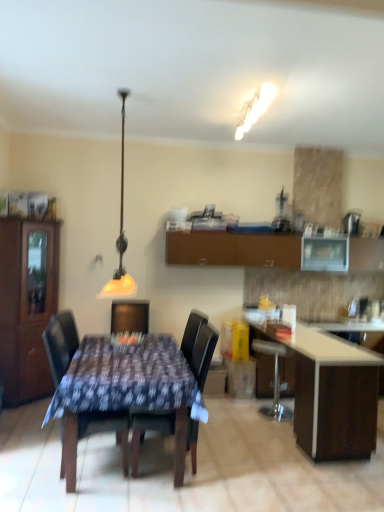
This screenshot has height=512, width=384. Describe the element at coordinates (60, 343) in the screenshot. I see `black wood chair at center, marked as the 1th chair in a left-to-right arrangement` at that location.

What do you see at coordinates (25, 310) in the screenshot? The width and height of the screenshot is (384, 512). I see `brown wood cabinet at left, the second cabinetry viewed from the back` at bounding box center [25, 310].

The height and width of the screenshot is (512, 384). Describe the element at coordinates (331, 392) in the screenshot. I see `white glossy table at lower right` at that location.

The width and height of the screenshot is (384, 512). I want to click on matte yellow glass lampshade at upper center, so click(x=120, y=234).

Which of these two, matte yellow glass lampshade at upper center or black plastic blender at upper right, is bigger?

Bigger between the two is matte yellow glass lampshade at upper center.

Considering their positions, is matte yellow glass lampshade at upper center located in front of or behind black plastic blender at upper right?

In the image, matte yellow glass lampshade at upper center appears in front of black plastic blender at upper right.

Is point (123, 98) behind point (279, 217)?

No, (123, 98) is closer to viewer.

Is matte yellow glass lampshade at upper center shorter than black plastic blender at upper right?

No, matte yellow glass lampshade at upper center is not shorter than black plastic blender at upper right.

Is white frosted glass light fixture at upper center oriented towards matte yellow glass lampshade at upper center?

No, white frosted glass light fixture at upper center is not facing towards matte yellow glass lampshade at upper center.

In the image, there is a white frosted glass light fixture at upper center. Identify the location of lamp below it (from the image's perspective). This screenshot has width=384, height=512. (120, 234).

From a real-world perspective, is white frosted glass light fixture at upper center physically below matte yellow glass lampshade at upper center?

No, from a real-world perspective, white frosted glass light fixture at upper center is not under matte yellow glass lampshade at upper center.

From a real-world perspective, is white glossy table at lower right below white frosted glass light fixture at upper center?

Yes.

Is white glossy table at lower right not inside white frosted glass light fixture at upper center?

Yes, white glossy table at lower right is outside of white frosted glass light fixture at upper center.

From the image's perspective, is white glossy table at lower right above or below white frosted glass light fixture at upper center?

white glossy table at lower right is below white frosted glass light fixture at upper center.

Looking at this image, which object is closer to the camera, white glossy table at lower right or white frosted glass light fixture at upper center?

white glossy table at lower right is more forward.

Would you say matte yellow glass lampshade at upper center contains white glossy table at lower right?

That's incorrect, white glossy table at lower right is not inside matte yellow glass lampshade at upper center.

Consider the image. From their relative heights in the image, would you say matte yellow glass lampshade at upper center is taller or shorter than white glossy table at lower right?

In the image, matte yellow glass lampshade at upper center appears to be taller than white glossy table at lower right.

How many degrees apart are the facing directions of matte yellow glass lampshade at upper center and white glossy table at lower right?

They differ by 177 degrees in their facing directions.

From the image's perspective, which one is positioned higher, matte yellow glass lampshade at upper center or white glossy table at lower right?

matte yellow glass lampshade at upper center.

Considering the relative sizes of black wood chair at center, marked as the second chair in a right-to-left arrangement, and white frosted glass light fixture at upper center in the image provided, is black wood chair at center, marked as the second chair in a right-to-left arrangement, bigger than white frosted glass light fixture at upper center?

Indeed, black wood chair at center, marked as the second chair in a right-to-left arrangement, has a larger size compared to white frosted glass light fixture at upper center.

Would you say white frosted glass light fixture at upper center is part of black wood chair at center, marked as the 1th chair in a left-to-right arrangement,'s contents?

No, white frosted glass light fixture at upper center is not a part of black wood chair at center, marked as the 1th chair in a left-to-right arrangement.

The image size is (384, 512). In order to click on light fixture behind the black wood chair at center, marked as the second chair in a right-to-left arrangement in this screenshot , I will do `click(255, 108)`.

Considering the sizes of black wood chair at center, marked as the 1th chair in a left-to-right arrangement, and white frosted glass light fixture at upper center in the image, is black wood chair at center, marked as the 1th chair in a left-to-right arrangement, wider or thinner than white frosted glass light fixture at upper center?

black wood chair at center, marked as the 1th chair in a left-to-right arrangement, is wider than white frosted glass light fixture at upper center.

Is matte yellow glass lampshade at upper center at the right side of brown wood cabinet at left, which ranks as the second cabinetry in right-to-left order?

Indeed, matte yellow glass lampshade at upper center is positioned on the right side of brown wood cabinet at left, which ranks as the second cabinetry in right-to-left order.

Is matte yellow glass lampshade at upper center turned away from brown wood cabinet at left, the first cabinetry positioned from the front?

matte yellow glass lampshade at upper center does not have its back to brown wood cabinet at left, the first cabinetry positioned from the front.

Based on the photo, between matte yellow glass lampshade at upper center and brown wood cabinet at left, the second cabinetry viewed from the back, which one has less height?

Standing shorter between the two is matte yellow glass lampshade at upper center.

From the image's perspective, which object appears higher, matte yellow glass lampshade at upper center or brown wood cabinet at left, which ranks as the second cabinetry in right-to-left order?

matte yellow glass lampshade at upper center.

Is brown wood cabinet at left, marked as the 1th cabinetry in a left-to-right arrangement, bigger than black wood chair at center, marked as the 1th chair in a left-to-right arrangement?

Correct, brown wood cabinet at left, marked as the 1th cabinetry in a left-to-right arrangement, is larger in size than black wood chair at center, marked as the 1th chair in a left-to-right arrangement.

How distant is brown wood cabinet at left, the first cabinetry positioned from the front, from black wood chair at center, marked as the second chair in a right-to-left arrangement?

A distance of 5.15 feet exists between brown wood cabinet at left, the first cabinetry positioned from the front, and black wood chair at center, marked as the second chair in a right-to-left arrangement.

Which object is wider, brown wood cabinet at left, marked as the 1th cabinetry in a left-to-right arrangement, or black wood chair at center, marked as the second chair in a right-to-left arrangement?

black wood chair at center, marked as the second chair in a right-to-left arrangement, is wider.

Considering the positions of point (15, 285) and point (102, 421), is point (15, 285) closer or farther from the camera than point (102, 421)?

Point (15, 285) is positioned farther from the camera compared to point (102, 421).

This screenshot has height=512, width=384. I want to click on appliance that is below the matte yellow glass lampshade at upper center (from the image's perspective), so click(x=281, y=213).

Locate an element on the screen. lamp on the left of white frosted glass light fixture at upper center is located at coordinates (120, 234).

From the image, which object appears to be nearer to black wood chair at center, marked as the second chair in a right-to-left arrangement, brown wood cabinet at left, marked as the 1th cabinetry in a left-to-right arrangement, or brown matte cabinet at upper center, acting as the 1th cabinetry starting from the back?

brown wood cabinet at left, marked as the 1th cabinetry in a left-to-right arrangement.

When comparing their distances from white glossy table at lower right, does brown wood cabinet at left, the first cabinetry positioned from the front, or black wood chair at center, marked as the second chair in a right-to-left arrangement, seem further?

brown wood cabinet at left, the first cabinetry positioned from the front, is positioned further to the anchor white glossy table at lower right.

Which object lies nearer to the anchor point white glossy countertop at right, dark brown leather chair at center, arranged as the second chair when viewed from the left, or white frosted glass light fixture at upper center?

dark brown leather chair at center, arranged as the second chair when viewed from the left, is closer to white glossy countertop at right.

In the scene shown: Estimate the real-world distances between objects in this image. Which object is closer to brown wood cabinet at left, marked as the 1th cabinetry in a left-to-right arrangement, white frosted glass light fixture at upper center or matte yellow glass lampshade at upper center?

matte yellow glass lampshade at upper center is closer to brown wood cabinet at left, marked as the 1th cabinetry in a left-to-right arrangement.

Estimate the real-world distances between objects in this image. Which object is closer to dark brown leather chair at center, the 1th chair positioned from the right, white glossy table at lower right or black wood chair at center, marked as the 1th chair in a left-to-right arrangement?

black wood chair at center, marked as the 1th chair in a left-to-right arrangement, is closer to dark brown leather chair at center, the 1th chair positioned from the right.

Looking at the image, which one is located further to wooden table at center, brown matte cabinet at upper center, the first cabinetry viewed from the right, or white glossy table at lower right?

brown matte cabinet at upper center, the first cabinetry viewed from the right, is positioned further to the anchor wooden table at center.

Looking at the image, which one is located further to wooden table at center, matte yellow glass lampshade at upper center or dark brown leather chair at center, the 1th chair positioned from the right?

Among the two, matte yellow glass lampshade at upper center is located further to wooden table at center.

Considering their positions, is wooden table at center positioned closer to brown wood cabinet at left, the first cabinetry positioned from the front, than matte yellow glass lampshade at upper center?

matte yellow glass lampshade at upper center.

Locate an element on the screen. Image resolution: width=384 pixels, height=512 pixels. lamp between wooden table at center and brown matte cabinet at upper center, which is counted as the 2th cabinetry, starting from the left, along the z-axis is located at coordinates (120, 234).

What are the coordinates of `chair between brown wood cabinet at left, which ranks as the second cabinetry in right-to-left order, and dark brown leather chair at center, the 1th chair positioned from the right, in the horizontal direction` in the screenshot? It's located at (60, 343).

This screenshot has height=512, width=384. I want to click on chair between wooden table at center and white glossy table at lower right from left to right, so click(199, 346).

I want to click on cabinetry located between black wood chair at center, marked as the second chair in a right-to-left arrangement, and white glossy table at lower right in the left-right direction, so click(233, 249).